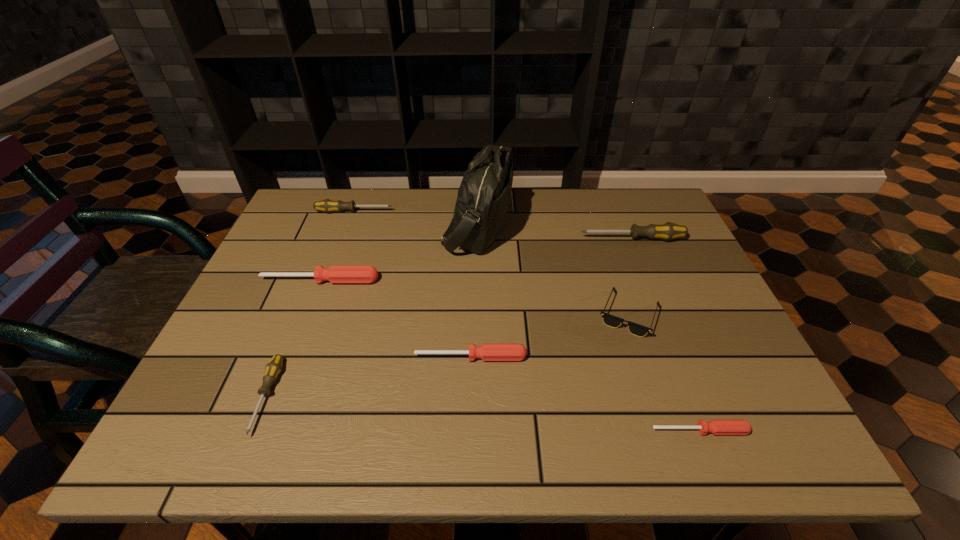
Identify the location of blank region between the rightmost red screwdriver and the fifth nearest screwdriver. This screenshot has width=960, height=540. (666, 335).

I want to click on vacant area that lies between the smallest red screwdriver and the shoulder bag, so click(x=588, y=328).

Locate an element on the screen. This screenshot has height=540, width=960. object that ranks as the closest to the third screwdriver from right to left is located at coordinates (610, 320).

Find the location of a particular element. Image resolution: width=960 pixels, height=540 pixels. object that can be found as the fourth closest to the sunglasses is located at coordinates (483, 198).

Where is `screwdriver that stands as the closest to the tallest object`? This screenshot has width=960, height=540. screwdriver that stands as the closest to the tallest object is located at coordinates (337, 274).

Locate an element on the screen. screwdriver that stands as the sixth closest to the tallest object is located at coordinates (716, 426).

Identify the location of gray screwdriver that is the second nearest to the biggest gray screwdriver. (274, 367).

Choose which gray screwdriver is the second nearest neighbor to the nearest gray screwdriver. Please provide its 2D coordinates. Your answer should be formatted as a tuple, i.e. [(x, y)], where the tuple contains the x and y coordinates of a point satisfying the conditions above.

[(667, 231)]

Where is `red screwdriver identified as the closest to the third farthest screwdriver`? red screwdriver identified as the closest to the third farthest screwdriver is located at coordinates (487, 352).

Identify which red screwdriver is located as the second nearest to the tallest screwdriver. Please provide its 2D coordinates. Your answer should be formatted as a tuple, i.e. [(x, y)], where the tuple contains the x and y coordinates of a point satisfying the conditions above.

[(716, 426)]